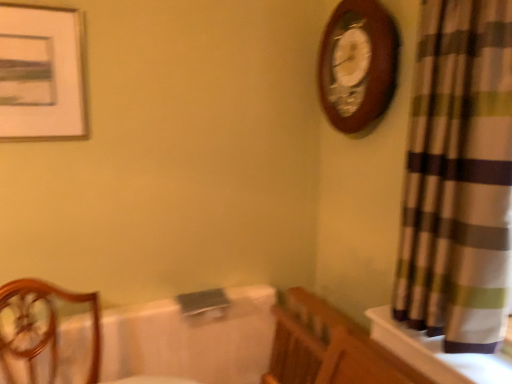
Question: Is wooden chair at left at the back of matte white picture frame at upper left?

Choices:
 (A) no
 (B) yes

Answer: (A)

Question: Considering the relative sizes of matte white picture frame at upper left and wooden chair at left in the image provided, is matte white picture frame at upper left smaller than wooden chair at left?

Choices:
 (A) no
 (B) yes

Answer: (B)

Question: Is matte white picture frame at upper left located outside wooden chair at left?

Choices:
 (A) no
 (B) yes

Answer: (B)

Question: Could you tell me if matte white picture frame at upper left is facing wooden chair at left?

Choices:
 (A) yes
 (B) no

Answer: (B)

Question: Does matte white picture frame at upper left come in front of wooden chair at left?

Choices:
 (A) no
 (B) yes

Answer: (A)

Question: Does matte white picture frame at upper left have a larger size compared to wooden chair at left?

Choices:
 (A) no
 (B) yes

Answer: (A)

Question: From a real-world perspective, does plaid fabric curtain at right sit lower than wooden wall clock at upper right?

Choices:
 (A) no
 (B) yes

Answer: (B)

Question: Is the position of plaid fabric curtain at right more distant than that of wooden wall clock at upper right?

Choices:
 (A) yes
 (B) no

Answer: (B)

Question: Is plaid fabric curtain at right placed right next to wooden wall clock at upper right?

Choices:
 (A) no
 (B) yes

Answer: (A)

Question: Does plaid fabric curtain at right have a greater width compared to wooden wall clock at upper right?

Choices:
 (A) yes
 (B) no

Answer: (A)

Question: Is plaid fabric curtain at right facing towards wooden wall clock at upper right?

Choices:
 (A) no
 (B) yes

Answer: (A)

Question: Is plaid fabric curtain at right to the right of wooden wall clock at upper right from the viewer's perspective?

Choices:
 (A) yes
 (B) no

Answer: (A)

Question: From the image's perspective, is white glossy bath at center under matte white picture frame at upper left?

Choices:
 (A) yes
 (B) no

Answer: (A)